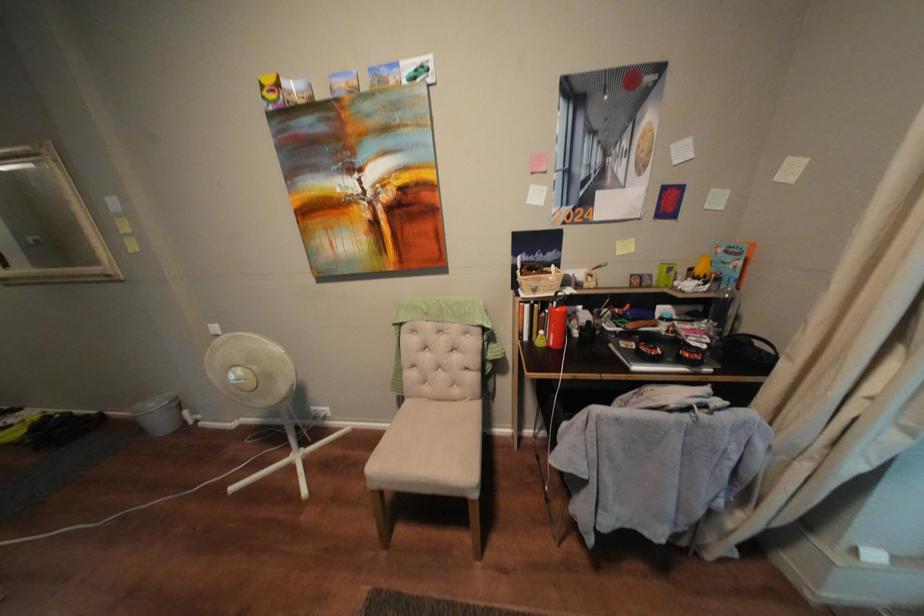
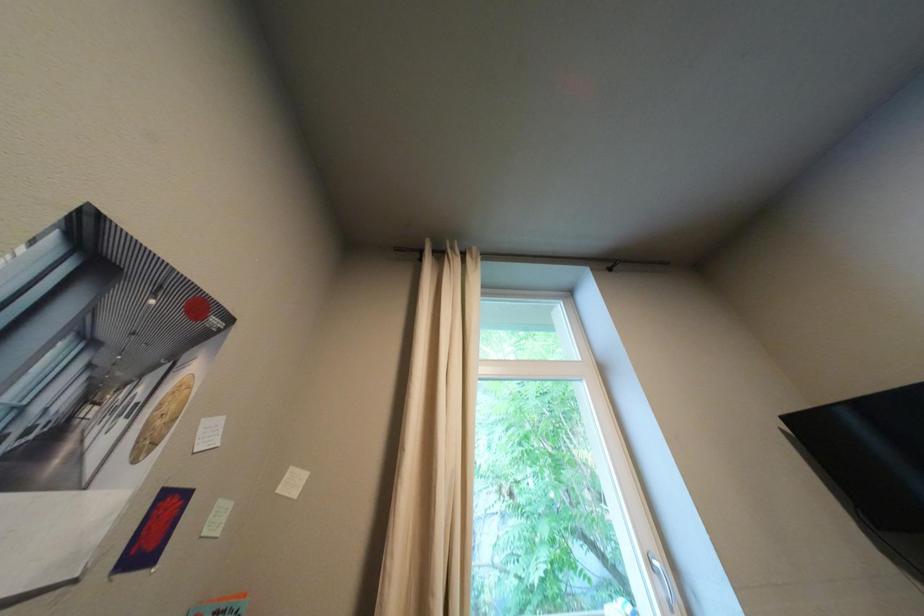
How did the camera likely rotate?

The camera's rotation is toward right-up.